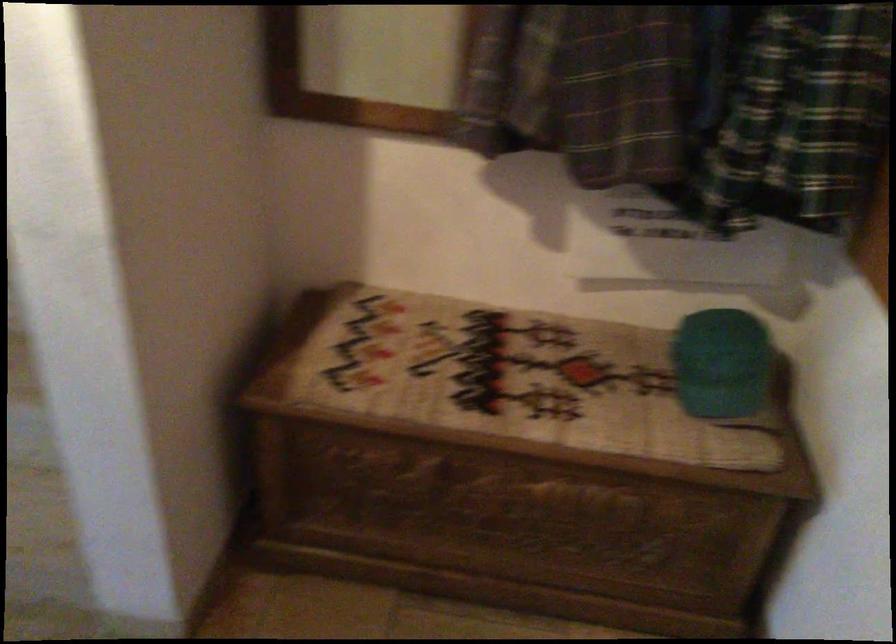
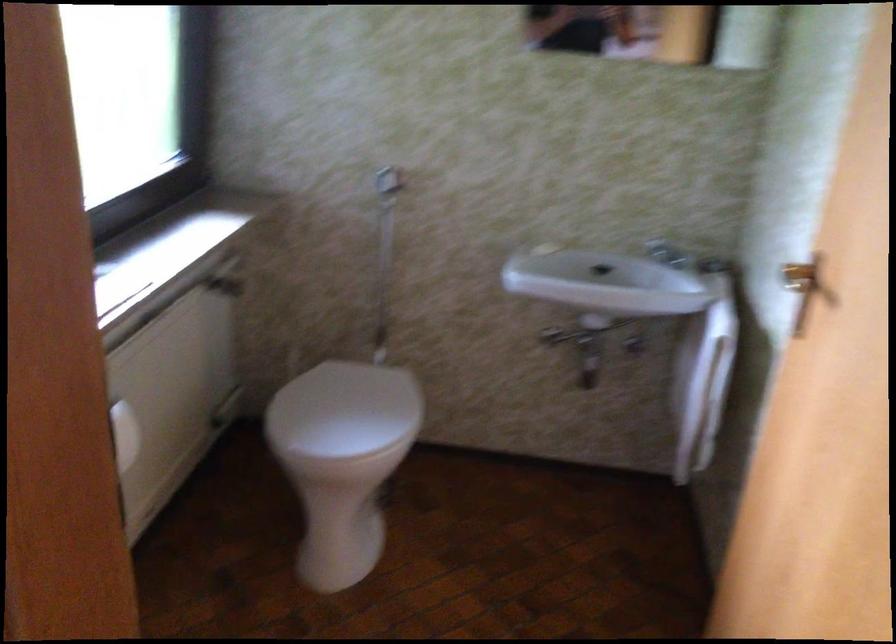
Question: The images are taken continuously from a first-person perspective. In which direction are you moving?

Choices:
 (A) Left
 (B) Right
 (C) Forward
 (D) Backward

Answer: (A)